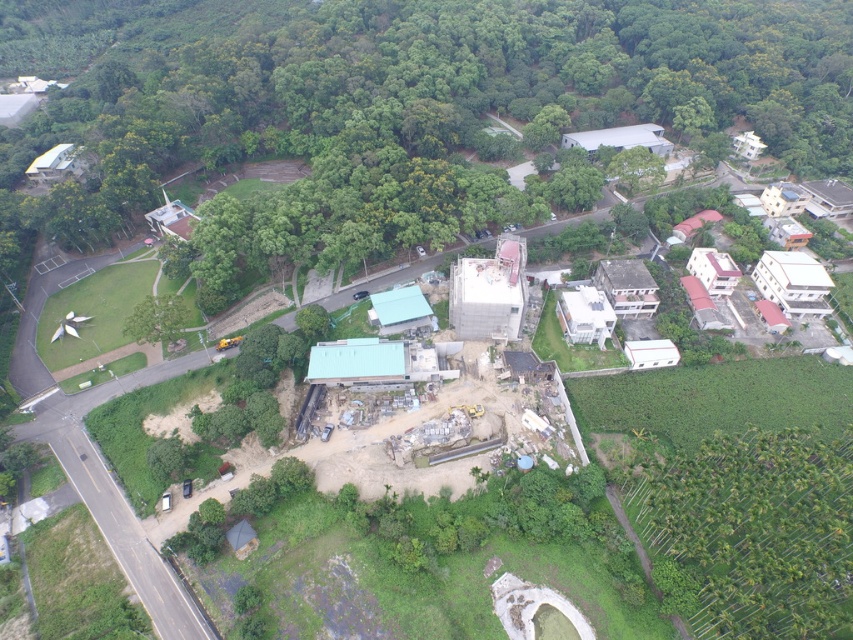
You are a park ranger planning to install a new trail between the green leafy tree at upper center and the green leafy trees at lower right. The trail requires a minimum of 300 feet of space. Can the trail be installed between these two points?

The green leafy tree at upper center and green leafy trees at lower right are 368.50 feet apart from each other. Since this distance exceeds the required 300 feet, the trail can be installed between these two points.

You are flying a drone and want to capture a photo of the green leafy tree at upper center and the green leafy trees at lower right. From your current position above the construction site, which group of trees should you focus on first to ensure they are in the foreground of the photo?

You should focus on the green leafy tree at upper center first because it is closer to your drone than the green leafy trees at lower right, which are positioned behind it.